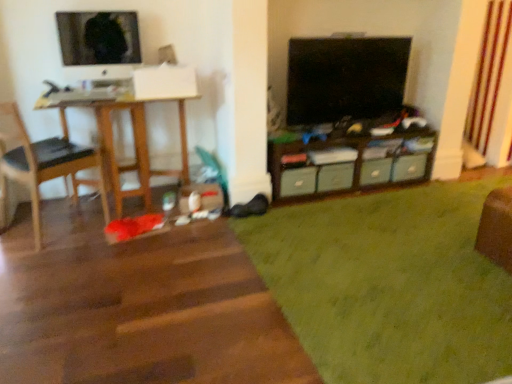
This screenshot has width=512, height=384. What are the coordinates of `free spot in front of green matte drawer at center, positioned as the 2th drawer in right-to-left order` in the screenshot? It's located at (382, 193).